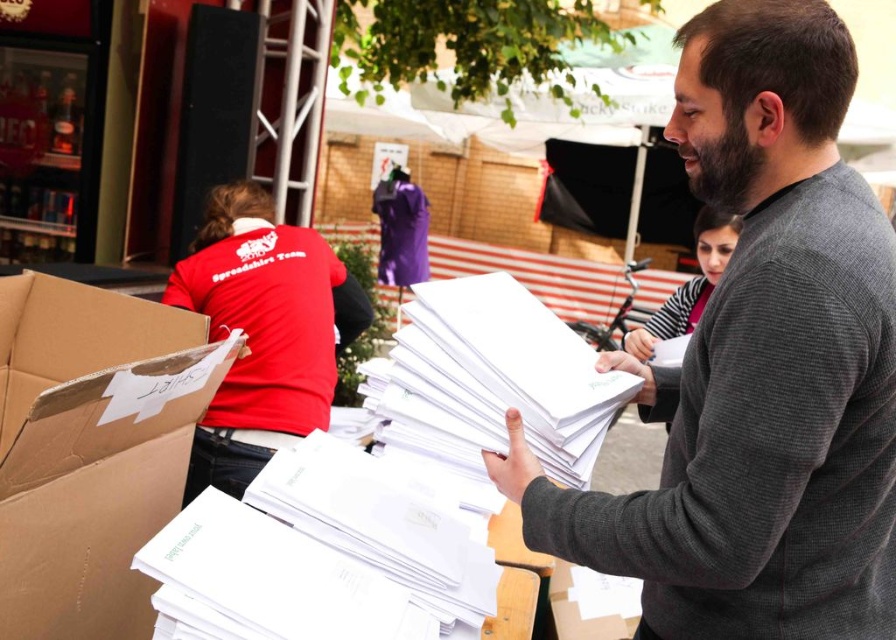
Is point (3, 468) in front of point (734, 131)?

That is True.

Based on the photo, who is more distant from viewer, (85, 320) or (739, 188)?

Positioned behind is point (85, 320).

Does point (29, 474) lie in front of point (722, 172)?

Yes, point (29, 474) is in front of point (722, 172).

Where is `brown cardboard box at lower left`? brown cardboard box at lower left is located at coordinates (85, 454).

Is gray wool sweater at center thinner than brown cardboard box at lower left?

Incorrect, gray wool sweater at center's width is not less than brown cardboard box at lower left's.

Is gray wool sweater at center to the left of brown cardboard box at lower left from the viewer's perspective?

In fact, gray wool sweater at center is to the right of brown cardboard box at lower left.

Looking at this image, who is more distant from viewer, (875,298) or (7,385)?

The point (7,385) is behind.

You are a GUI agent. You are given a task and a screenshot of the screen. Output one action in this format:
    pyautogui.click(x=<x>, y=<y>)
    Task: Click on the gray wool sweater at center
    The image size is (896, 640).
    Given the screenshot: What is the action you would take?
    pyautogui.click(x=760, y=372)

Who is positioned more to the left, gray wool sweater at center or dark brown thick beard at center?

From the viewer's perspective, gray wool sweater at center appears more on the left side.

Is gray wool sweater at center behind dark brown thick beard at center?

No, gray wool sweater at center is closer to the viewer.

Image resolution: width=896 pixels, height=640 pixels. What do you see at coordinates (760, 372) in the screenshot?
I see `gray wool sweater at center` at bounding box center [760, 372].

Identify the location of gray wool sweater at center. (760, 372).